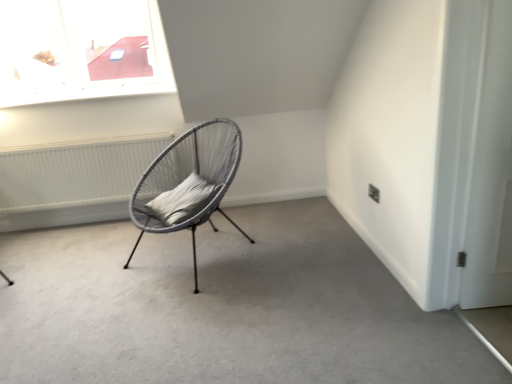
Where is `vacant space situated on the left part of matte grey wicker chair at center`? vacant space situated on the left part of matte grey wicker chair at center is located at coordinates (86, 271).